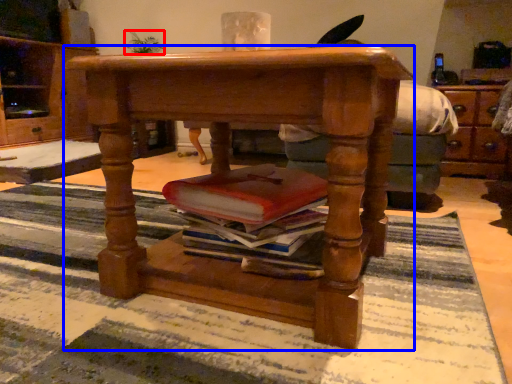
Question: Among these objects, which one is nearest to the camera, houseplant (highlighted by a red box) or desk (highlighted by a blue box)?

Choices:
 (A) houseplant
 (B) desk

Answer: (B)